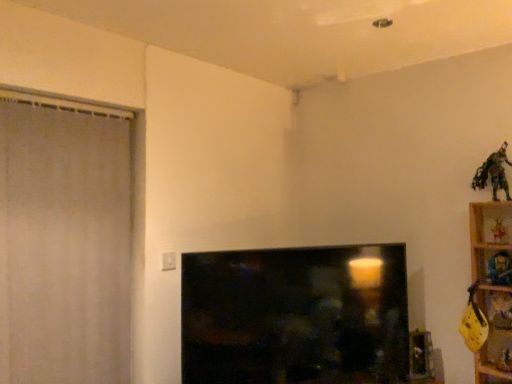
Question: Choose the correct answer: Is wooden shelf at right inside metallic gold figurine at upper right, which is the 4th toy from bottom to top, or outside it?

Choices:
 (A) outside
 (B) inside

Answer: (A)

Question: Is point (498, 367) positioned closer to the camera than point (498, 283)?

Choices:
 (A) farther
 (B) closer

Answer: (B)

Question: Estimate the real-world distances between objects in this image. Which object is closer to the plush fabric toy at upper right, positioned as the fourth toy in top-to-bottom order?

Choices:
 (A) yellow fabric toy at lower right, the first toy from the bottom
 (B) black glossy tv at center
 (C) wooden shelf at right
 (D) yellow fabric toy at right, which is counted as the second toy, starting from the bottom
 (E) metallic gold figurine at upper right, acting as the third toy starting from the top

Answer: (D)

Question: Which is farther from the black glossy tv at center?

Choices:
 (A) yellow fabric toy at lower right, placed as the sixth toy when sorted from top to bottom
 (B) metallic green figure at upper right, arranged as the 1th toy when viewed from the top
 (C) plush fabric toy at upper right, positioned as the fourth toy in top-to-bottom order
 (D) yellow fabric toy at right, which is counted as the second toy, starting from the bottom
 (E) wooden toy at upper right, the 2th toy in the top-to-bottom sequence

Answer: (B)